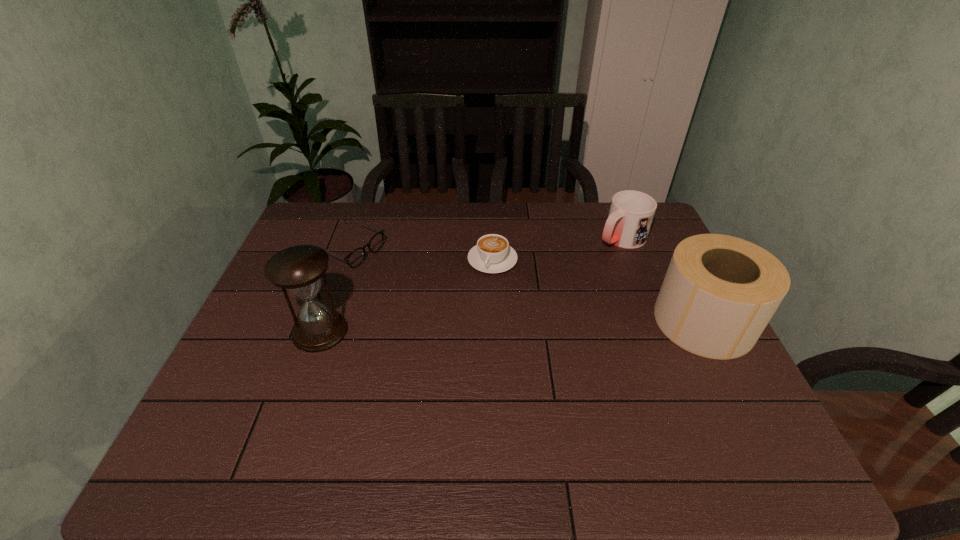
You are a GUI agent. You are given a task and a screenshot of the screen. Output one action in this format:
    pyautogui.click(x=<x>, y=<y>)
    Task: Click on the toilet tissue located in the right edge section of the desktop
    The width and height of the screenshot is (960, 540).
    Given the screenshot: What is the action you would take?
    pyautogui.click(x=719, y=293)

You are a GUI agent. You are given a task and a screenshot of the screen. Output one action in this format:
    pyautogui.click(x=<x>, y=<y>)
    Task: Click on the mug that is at the right edge
    This screenshot has height=540, width=960.
    Given the screenshot: What is the action you would take?
    pyautogui.click(x=631, y=213)

This screenshot has height=540, width=960. Identify the location of object that is positioned at the far left corner. (355, 258).

Where is `object positioned at the far right corner`? object positioned at the far right corner is located at coordinates (631, 213).

The image size is (960, 540). In the image, there is a desktop. What are the coordinates of `free space at the far edge` in the screenshot? It's located at (396, 213).

At what (x,y) coordinates should I click in order to perform the action: click on vacant region at the near edge of the desktop. Please return your answer as a coordinate pair (x, y). Looking at the image, I should click on (529, 415).

Identify the location of vacant space at the right edge of the desktop. The image size is (960, 540). (730, 364).

Identify the location of vacant position at the far left corner of the desktop. (305, 224).

Locate an element on the screen. The width and height of the screenshot is (960, 540). vacant position at the far right corner of the desktop is located at coordinates (654, 241).

Where is `empty location between the cappuccino and the spectacles`? This screenshot has width=960, height=540. empty location between the cappuccino and the spectacles is located at coordinates (420, 254).